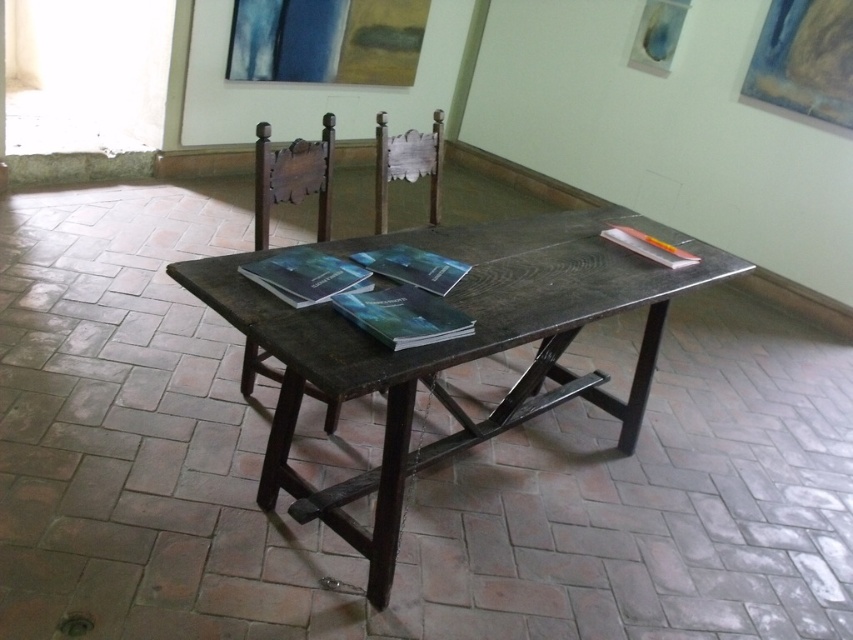
Question: Is dark wood chair at center bigger than wooden chair at center?

Choices:
 (A) yes
 (B) no

Answer: (B)

Question: Can you confirm if dark wood chair at center is positioned to the right of wooden chair at center?

Choices:
 (A) no
 (B) yes

Answer: (A)

Question: Which point appears closest to the camera in this image?

Choices:
 (A) (271, 179)
 (B) (428, 164)

Answer: (A)

Question: Is dark wood chair at center bigger than wooden chair at center?

Choices:
 (A) no
 (B) yes

Answer: (A)

Question: Estimate the real-world distances between objects in this image. Which object is closer to the dark wood chair at center?

Choices:
 (A) dark wood table at center
 (B) wooden chair at center

Answer: (B)

Question: Which object is closer to the camera taking this photo?

Choices:
 (A) dark wood chair at center
 (B) wooden chair at center

Answer: (A)